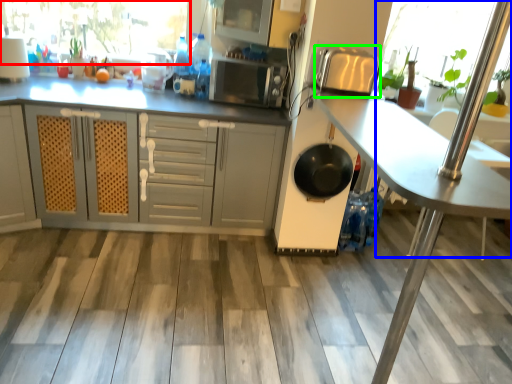
Question: Which object is the farthest from window screen (highlighted by a red box)? Choose among these: glass door (highlighted by a blue box) or appliance (highlighted by a green box).

Choices:
 (A) glass door
 (B) appliance

Answer: (A)